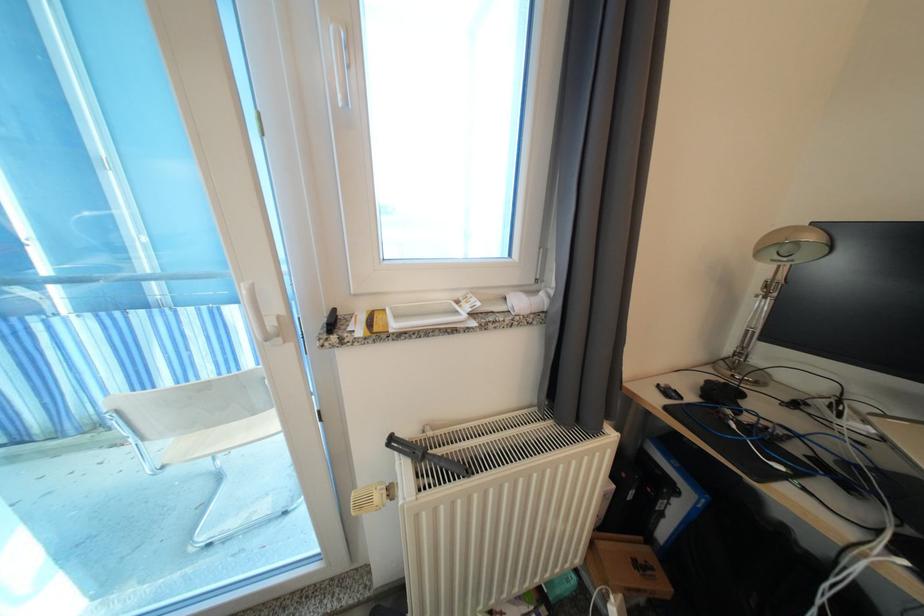
This screenshot has height=616, width=924. Find the location of `desk lamp head`. desk lamp head is located at coordinates (792, 245).